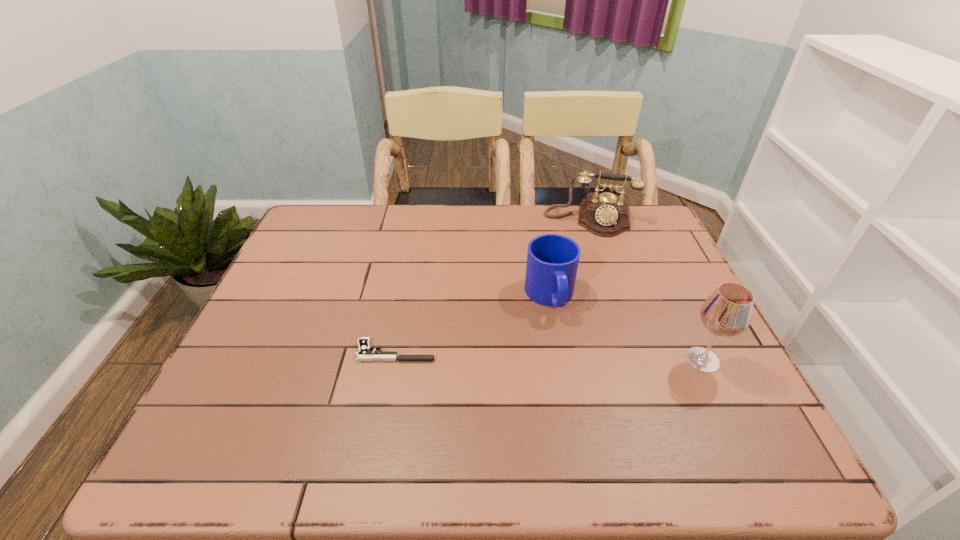
The height and width of the screenshot is (540, 960). What are the coordinates of `free region at the near edge of the desktop` in the screenshot? It's located at (559, 396).

Locate an element on the screen. vacant space at the left edge of the desktop is located at coordinates (292, 381).

Locate an element on the screen. The width and height of the screenshot is (960, 540). vacant space at the right edge of the desktop is located at coordinates (654, 261).

Find the location of `vacant region at the far left corner of the desktop`. vacant region at the far left corner of the desktop is located at coordinates (342, 232).

Locate an element on the screen. vacant space at the far right corner is located at coordinates (637, 218).

The height and width of the screenshot is (540, 960). What are the coordinates of `vacant point located between the wineglass and the second farthest object` in the screenshot? It's located at (626, 328).

At what (x,y) coordinates should I click in order to perform the action: click on vacant area that lies between the third nearest object and the tallest object. Please return your answer as a coordinate pair (x, y). The height and width of the screenshot is (540, 960). Looking at the image, I should click on (626, 328).

Where is `vacant point located between the wineglass and the shortest object`? vacant point located between the wineglass and the shortest object is located at coordinates point(549,356).

Where is `unoccupied area between the shortest object and the farthest object`? The image size is (960, 540). unoccupied area between the shortest object and the farthest object is located at coordinates (492, 286).

Identify the location of vacant area between the leftmost object and the telephone. The width and height of the screenshot is (960, 540). (492, 286).